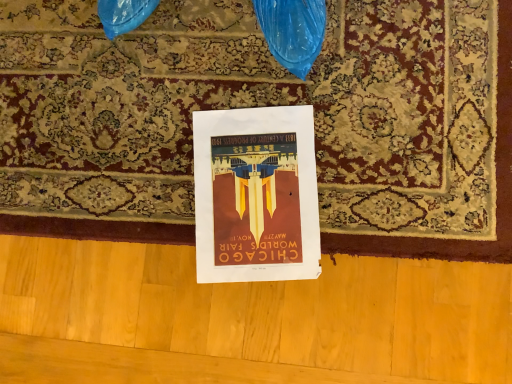
Locate an element on the screen. blank space above matte paper poster at center (from a real-world perspective) is located at coordinates (248, 189).